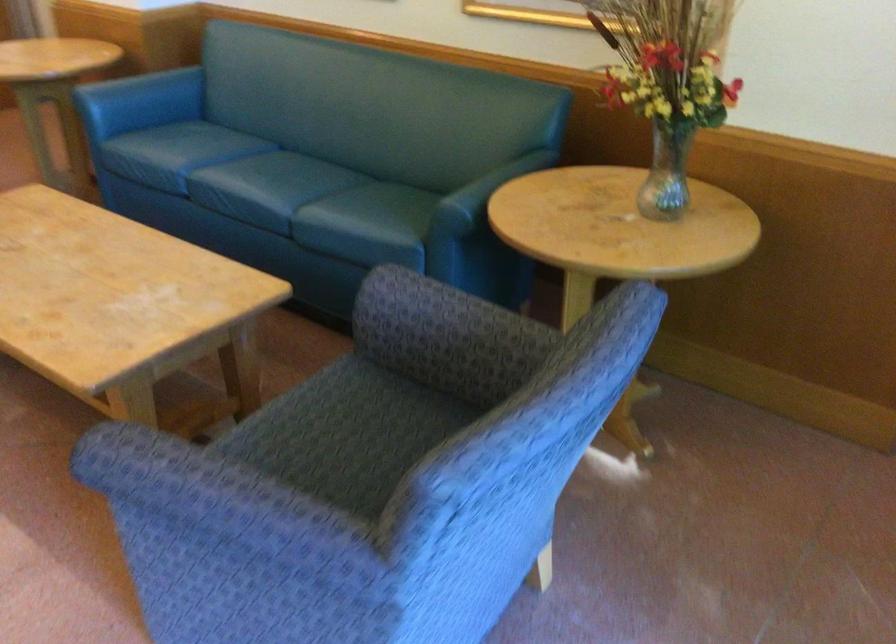
Question: The first image is from the beginning of the video and the second image is from the end. How did the camera likely rotate when shooting the video?

Choices:
 (A) Left
 (B) Right
 (C) Up
 (D) Down

Answer: (A)